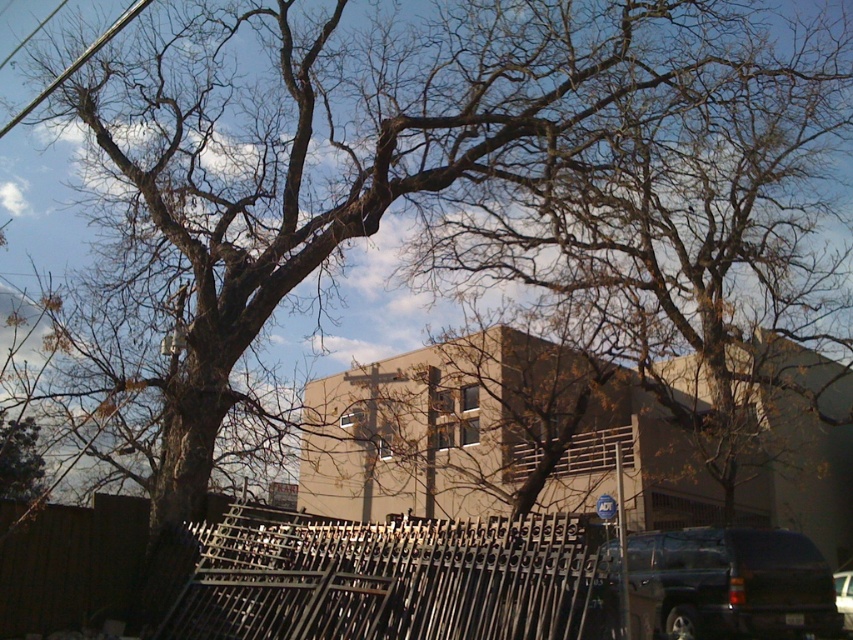
Which of these two, matte black suv at lower right or metallic wire at upper left, stands shorter?

matte black suv at lower right is shorter.

This screenshot has width=853, height=640. What do you see at coordinates (728, 586) in the screenshot?
I see `matte black suv at lower right` at bounding box center [728, 586].

You are a GUI agent. You are given a task and a screenshot of the screen. Output one action in this format:
    pyautogui.click(x=<x>, y=<y>)
    Task: Click on the matte black suv at lower right
    This screenshot has height=640, width=853.
    Given the screenshot: What is the action you would take?
    pyautogui.click(x=728, y=586)

Which is below, matte black suv at lower right or shiny black suv at lower right?

shiny black suv at lower right is lower down.

Is point (755, 634) in front of point (834, 584)?

That is True.

Image resolution: width=853 pixels, height=640 pixels. What do you see at coordinates (728, 586) in the screenshot?
I see `matte black suv at lower right` at bounding box center [728, 586].

Find the location of a particular element. The width and height of the screenshot is (853, 640). matte black suv at lower right is located at coordinates (728, 586).

Is metallic silver fence at lower center above shiny black suv at lower right?

Indeed, metallic silver fence at lower center is positioned over shiny black suv at lower right.

How distant is metallic silver fence at lower center from shiny black suv at lower right?

The distance of metallic silver fence at lower center from shiny black suv at lower right is 12.08 meters.

The image size is (853, 640). What are the coordinates of `metallic silver fence at lower center` in the screenshot? It's located at (387, 579).